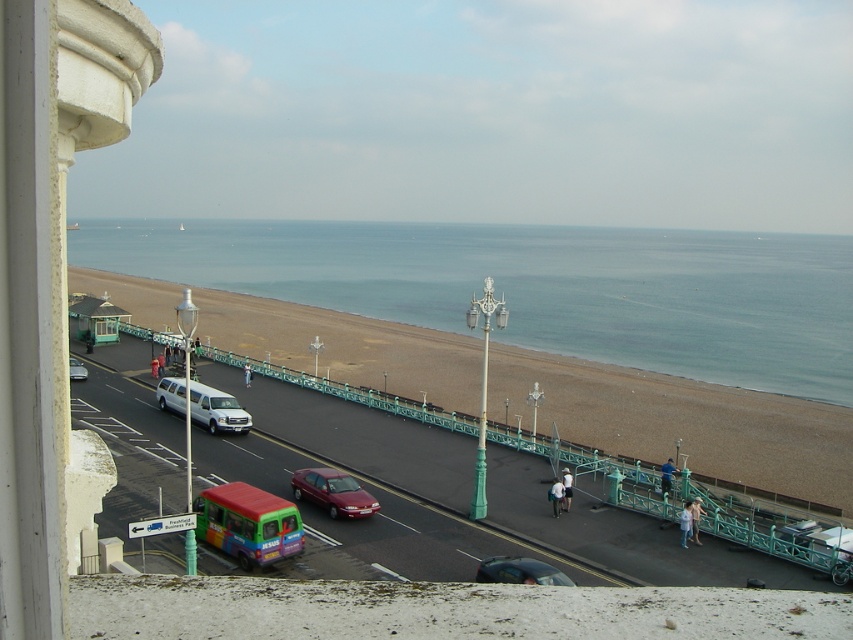
Who is shorter, brown sand at lower center or metallic silver van at center-left?

metallic silver van at center-left is shorter.

Between point (291, 344) and point (73, 365), which one is positioned behind?

Point (291, 344)

Which is in front, point (828, 410) or point (71, 362)?

Point (71, 362) is in front.

This screenshot has height=640, width=853. I want to click on brown sand at lower center, so click(x=683, y=420).

Which is behind, point (207, 387) or point (83, 378)?

The point (83, 378) is more distant.

Is white glossy van at center wider than metallic silver van at center-left?

Yes.

Does point (177, 388) come farther from viewer compared to point (70, 364)?

No, (177, 388) is closer to viewer.

Find the location of a particular element. The width and height of the screenshot is (853, 640). white glossy van at center is located at coordinates (202, 404).

Is brown sand at lower center shorter than shiny red sedan at center?

No, brown sand at lower center is not shorter than shiny red sedan at center.

Consider the image. Who is more distant from viewer, (596, 392) or (316, 468)?

The point (596, 392) is more distant.

Locate an element on the screen. brown sand at lower center is located at coordinates (683, 420).